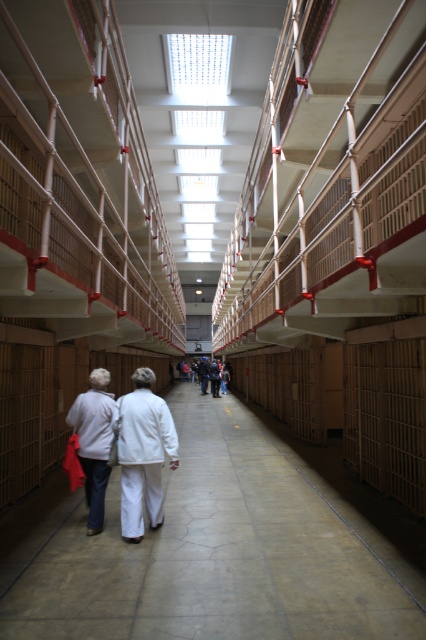
Question: Does white fabric at center lie in front of dark gray sweater at center?

Choices:
 (A) no
 (B) yes

Answer: (B)

Question: Where is white fabric at center located in relation to dark blue jeans at center in the image?

Choices:
 (A) right
 (B) left

Answer: (A)

Question: Which point is closer to the camera?

Choices:
 (A) (74, 419)
 (B) (206, 362)
 (C) (158, 422)
 (D) (212, 381)

Answer: (C)

Question: Is white fabric pants at center positioned behind dark gray sweater at center?

Choices:
 (A) no
 (B) yes

Answer: (A)

Question: Which object appears farthest from the camera in this image?

Choices:
 (A) dark gray sweater at center
 (B) dark blue jeans at center
 (C) white fabric pants at center
 (D) white fabric at center

Answer: (B)

Question: Estimate the real-world distances between objects in this image. Which object is closer to the dark gray sweater at center?

Choices:
 (A) white fabric pants at center
 (B) white fabric at center

Answer: (A)